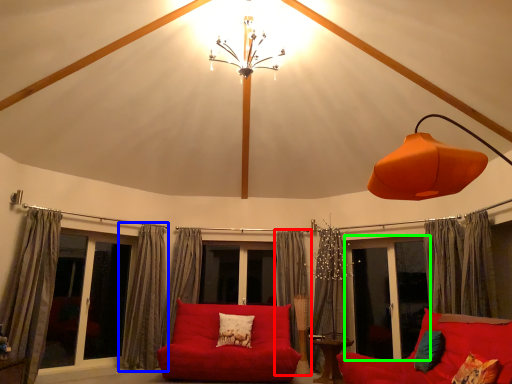
Question: Which is nearer to the curtain (highlighted by a red box)? curtain (highlighted by a blue box) or window screen (highlighted by a green box).

Choices:
 (A) curtain
 (B) window screen

Answer: (B)